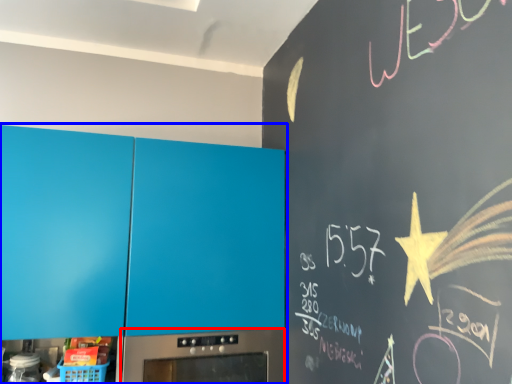
Question: Among these objects, which one is farthest to the camera, home appliance (highlighted by a red box) or cabinetry (highlighted by a blue box)?

Choices:
 (A) home appliance
 (B) cabinetry

Answer: (A)